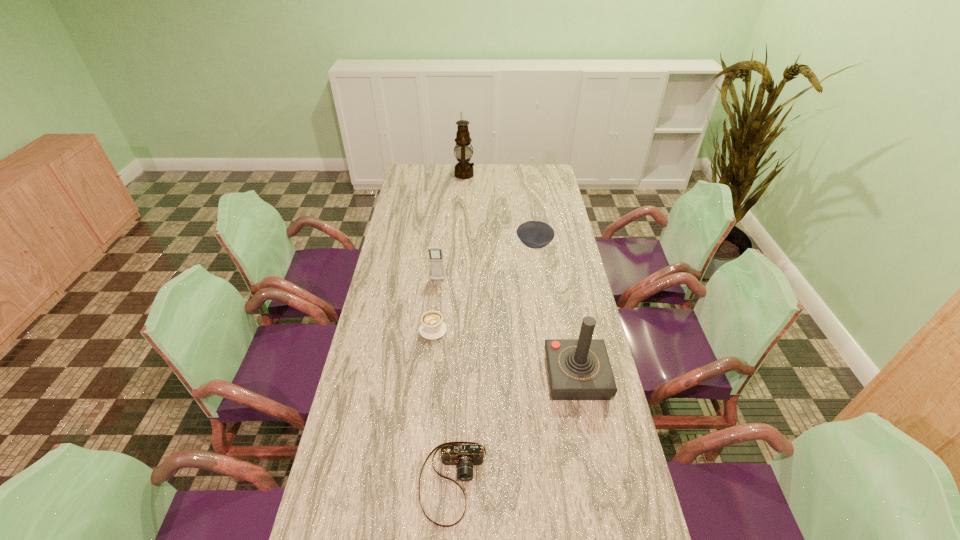
Find the location of a particular element. The width and height of the screenshot is (960, 540). free space at the right edge of the desktop is located at coordinates (606, 408).

What are the coordinates of `vacant space at the far left corner of the desktop` in the screenshot? It's located at (405, 177).

In the image, there is a desktop. Where is `vacant region at the far right corner`? vacant region at the far right corner is located at coordinates (527, 170).

Where is `free space that is in between the joystick and the farthest object`? This screenshot has height=540, width=960. free space that is in between the joystick and the farthest object is located at coordinates (520, 276).

I want to click on vacant area between the nearest object and the tallest object, so pos(459,328).

Locate an element on the screen. The width and height of the screenshot is (960, 540). vacant region between the bowl and the second nearest object is located at coordinates (555, 311).

Where is `vacant space that's between the fourth farthest object and the second tallest object`? The height and width of the screenshot is (540, 960). vacant space that's between the fourth farthest object and the second tallest object is located at coordinates (505, 353).

The image size is (960, 540). What are the coordinates of `free space between the third farthest object and the fifth shortest object` in the screenshot? It's located at (507, 329).

Find the location of a particular element. This screenshot has width=960, height=540. free space between the third farthest object and the joystick is located at coordinates (507, 329).

Locate an element on the screen. free area in between the bowl and the fourth shortest object is located at coordinates (486, 263).